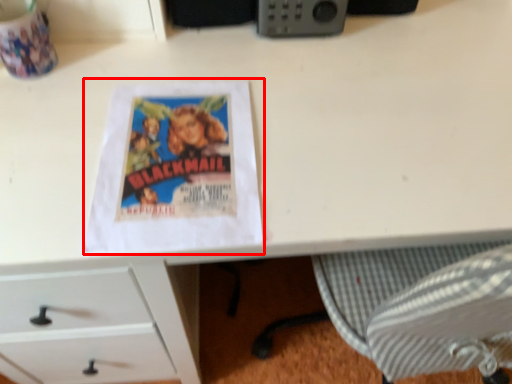
Question: In this image, where is paperback book (annotated by the red box) located relative to gadget?

Choices:
 (A) right
 (B) left

Answer: (B)